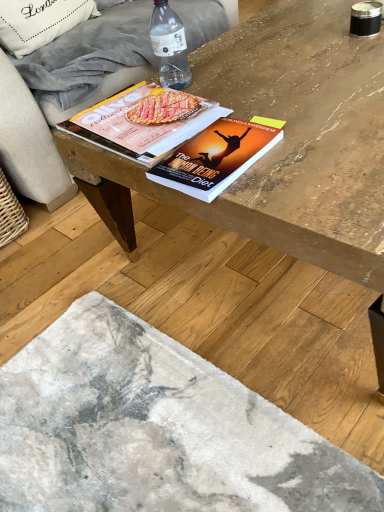
Identify the location of free space behind transparent plastic bottle at upper center. (193, 62).